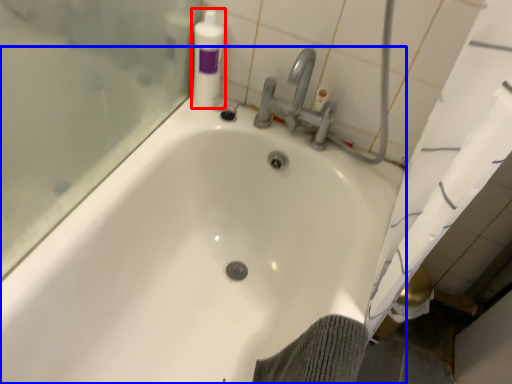
Question: Which point is further to the camera, cleaning product (highlighted by a red box) or bathtub (highlighted by a blue box)?

Choices:
 (A) cleaning product
 (B) bathtub

Answer: (A)